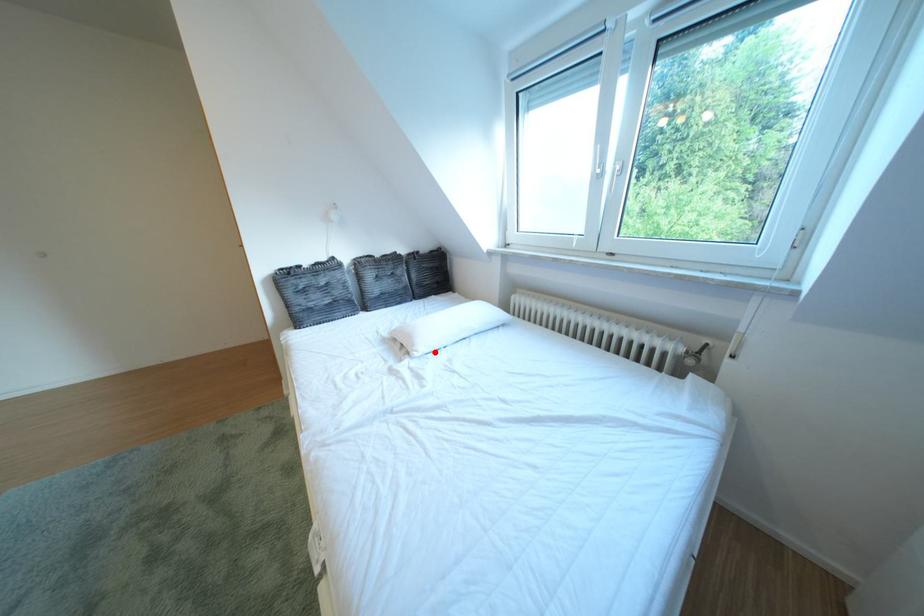
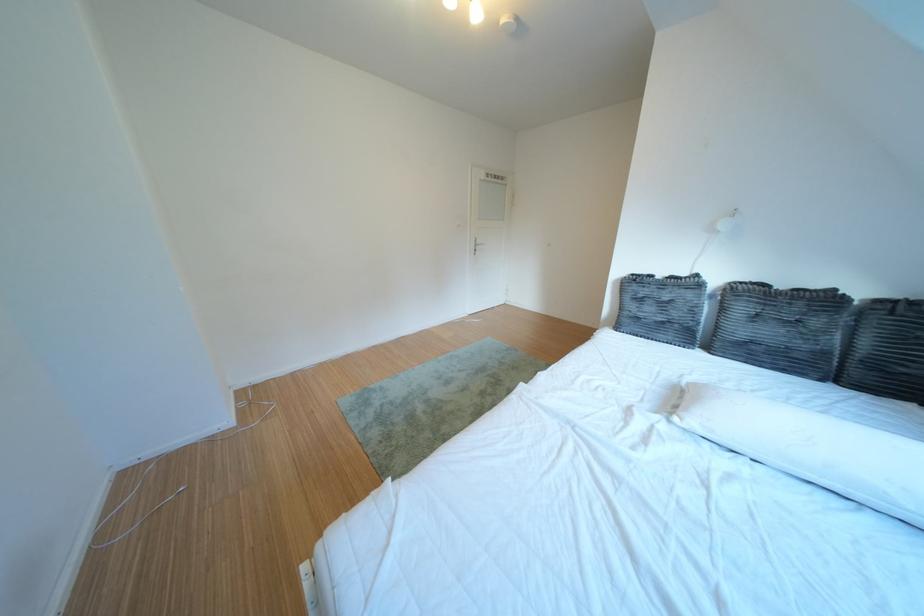
Question: I am providing you with two images of the same scene from different viewpoints. Image1 has a red point marked. In image2, the corresponding 3D location appears at what relative position? Reply with the corresponding letter.

Choices:
 (A) Closer
 (B) Farther

Answer: (B)